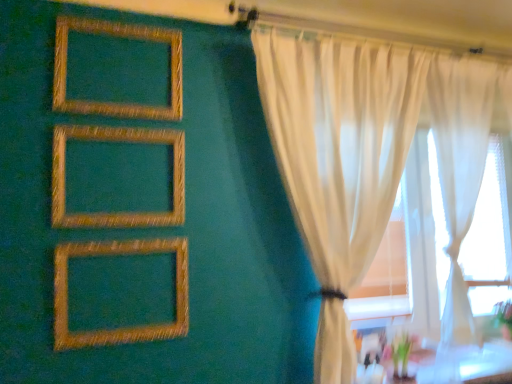
The image size is (512, 384). Describe the element at coordinates (120, 37) in the screenshot. I see `gold textured frame at upper left, acting as the 3th picture frame starting from the bottom` at that location.

Identify the location of gold textured picture frame at lower left, which is counted as the third picture frame, starting from the top. (119, 328).

Find the location of a particular element. gold textured frame at upper left, acting as the 3th picture frame starting from the bottom is located at coordinates (120, 37).

Which point is more forward, (104,103) or (63,253)?

The point (63,253) is closer to the camera.

Considering the relative sizes of gold textured frame at upper left, the 1th picture frame viewed from the top, and gold textured picture frame at lower left, placed as the first picture frame when sorted from bottom to top, in the image provided, is gold textured frame at upper left, the 1th picture frame viewed from the top, taller than gold textured picture frame at lower left, placed as the first picture frame when sorted from bottom to top,?

Indeed, gold textured frame at upper left, the 1th picture frame viewed from the top, has a greater height compared to gold textured picture frame at lower left, placed as the first picture frame when sorted from bottom to top.

From the image's perspective, relative to gold textured picture frame at lower left, which is counted as the third picture frame, starting from the top, is gold textured frame at upper left, the 1th picture frame viewed from the top, above or below?

From the image's perspective, gold textured frame at upper left, the 1th picture frame viewed from the top, appears above gold textured picture frame at lower left, which is counted as the third picture frame, starting from the top.

Is gold textured frame at upper left, the 1th picture frame viewed from the top, oriented towards gold textured picture frame at lower left, which is counted as the third picture frame, starting from the top?

No, gold textured frame at upper left, the 1th picture frame viewed from the top, is not turned towards gold textured picture frame at lower left, which is counted as the third picture frame, starting from the top.

Locate an element on the screen. This screenshot has height=384, width=512. the 1st picture frame above when counting from the sheer white curtains at right (from the image's perspective) is located at coordinates (116, 141).

Can you see sheer white curtains at right touching gold textured frame at center, placed as the second picture frame when sorted from top to bottom?

→ No, sheer white curtains at right is not with gold textured frame at center, placed as the second picture frame when sorted from top to bottom.

Considering the positions of objects sheer white curtains at right and gold textured frame at center, placed as the second picture frame when sorted from top to bottom, in the image provided, who is more to the right, sheer white curtains at right or gold textured frame at center, placed as the second picture frame when sorted from top to bottom,?

sheer white curtains at right.

Is sheer white curtains at right behind gold textured frame at upper left, the 1th picture frame viewed from the top?

Yes, sheer white curtains at right is behind gold textured frame at upper left, the 1th picture frame viewed from the top.

From the image's perspective, is sheer white curtains at right located above or below gold textured frame at upper left, the 1th picture frame viewed from the top?

From the image's perspective, sheer white curtains at right appears below gold textured frame at upper left, the 1th picture frame viewed from the top.

Is sheer white curtains at right bigger than gold textured frame at upper left, acting as the 3th picture frame starting from the bottom?

Correct, sheer white curtains at right is larger in size than gold textured frame at upper left, acting as the 3th picture frame starting from the bottom.

Is point (109, 28) closer or farther from the camera than point (469, 249)?

Point (109, 28) is closer to the camera than point (469, 249).

Considering the positions of objects gold textured frame at upper left, the 1th picture frame viewed from the top, and sheer white curtains at right in the image provided, who is in front, gold textured frame at upper left, the 1th picture frame viewed from the top, or sheer white curtains at right?

gold textured frame at upper left, the 1th picture frame viewed from the top.

From the picture: Based on their positions, is gold textured frame at upper left, the 1th picture frame viewed from the top, located to the left or right of sheer white curtains at right?

From the image, it's evident that gold textured frame at upper left, the 1th picture frame viewed from the top, is to the left of sheer white curtains at right.

Is gold textured frame at upper left, acting as the 3th picture frame starting from the bottom, wider or thinner than sheer white curtains at right?

gold textured frame at upper left, acting as the 3th picture frame starting from the bottom, is thinner than sheer white curtains at right.

Would you say white sheer curtain at right is outside gold textured picture frame at lower left, placed as the first picture frame when sorted from bottom to top?

Yes.

Visually, is white sheer curtain at right positioned to the left or to the right of gold textured picture frame at lower left, placed as the first picture frame when sorted from bottom to top?

In the image, white sheer curtain at right appears on the right side of gold textured picture frame at lower left, placed as the first picture frame when sorted from bottom to top.

You are a GUI agent. You are given a task and a screenshot of the screen. Output one action in this format:
    pyautogui.click(x=<x>, y=<y>)
    Task: Click on the picture frame that is below the white sheer curtain at right (from the image's perspective)
    This screenshot has width=512, height=384.
    Given the screenshot: What is the action you would take?
    pyautogui.click(x=119, y=328)

Measure the distance from gold textured frame at center, which ranks as the second picture frame in bottom-to-top order, to gold textured picture frame at lower left, placed as the first picture frame when sorted from bottom to top.

A distance of 9.43 inches exists between gold textured frame at center, which ranks as the second picture frame in bottom-to-top order, and gold textured picture frame at lower left, placed as the first picture frame when sorted from bottom to top.

The width and height of the screenshot is (512, 384). I want to click on picture frame on the right of gold textured frame at center, placed as the second picture frame when sorted from top to bottom, so click(119, 328).

Considering the relative positions of gold textured frame at center, which ranks as the second picture frame in bottom-to-top order, and gold textured picture frame at lower left, which is counted as the third picture frame, starting from the top, in the image provided, is gold textured frame at center, which ranks as the second picture frame in bottom-to-top order, in front of gold textured picture frame at lower left, which is counted as the third picture frame, starting from the top,?

No, gold textured frame at center, which ranks as the second picture frame in bottom-to-top order, is further to the viewer.

From a real-world perspective, relative to gold textured picture frame at lower left, placed as the first picture frame when sorted from bottom to top, is gold textured frame at center, placed as the second picture frame when sorted from top to bottom, vertically above or below?

In terms of real-world spatial position, gold textured frame at center, placed as the second picture frame when sorted from top to bottom, is above gold textured picture frame at lower left, placed as the first picture frame when sorted from bottom to top.

The image size is (512, 384). I want to click on bay window behind the gold textured picture frame at lower left, which is counted as the third picture frame, starting from the top, so click(x=489, y=226).

Is gold textured picture frame at lower left, which is counted as the third picture frame, starting from the top, to the left or to the right of sheer white curtains at right in the image?

In the image, gold textured picture frame at lower left, which is counted as the third picture frame, starting from the top, appears on the left side of sheer white curtains at right.

Considering the relative positions of gold textured picture frame at lower left, placed as the first picture frame when sorted from bottom to top, and sheer white curtains at right in the image provided, is gold textured picture frame at lower left, placed as the first picture frame when sorted from bottom to top, behind sheer white curtains at right?

No, gold textured picture frame at lower left, placed as the first picture frame when sorted from bottom to top, is in front of sheer white curtains at right.

You are a GUI agent. You are given a task and a screenshot of the screen. Output one action in this format:
    pyautogui.click(x=<x>, y=<y>)
    Task: Click on the 2nd picture frame behind the gold textured picture frame at lower left, which is counted as the third picture frame, starting from the top
    
    Given the screenshot: What is the action you would take?
    pyautogui.click(x=120, y=37)

From the sheer white curtains at right, count the 2nd picture frame to the left and point to it. Please provide its 2D coordinates.

[(116, 141)]

Looking at the image, which one is located further to gold textured picture frame at lower left, which is counted as the third picture frame, starting from the top, white sheer curtain at right or sheer white curtains at right?

sheer white curtains at right.

When comparing their distances from gold textured frame at upper left, acting as the 3th picture frame starting from the bottom, does gold textured picture frame at lower left, placed as the first picture frame when sorted from bottom to top, or gold textured frame at center, placed as the second picture frame when sorted from top to bottom, seem closer?

gold textured frame at center, placed as the second picture frame when sorted from top to bottom, is closer to gold textured frame at upper left, acting as the 3th picture frame starting from the bottom.

Based on the photo, which object lies further to the anchor point white sheer curtain at right, gold textured frame at upper left, acting as the 3th picture frame starting from the bottom, or gold textured picture frame at lower left, which is counted as the third picture frame, starting from the top?

gold textured picture frame at lower left, which is counted as the third picture frame, starting from the top, is further to white sheer curtain at right.

From the image, which object appears to be nearer to gold textured picture frame at lower left, which is counted as the third picture frame, starting from the top, sheer white curtains at right or gold textured frame at center, placed as the second picture frame when sorted from top to bottom?

gold textured frame at center, placed as the second picture frame when sorted from top to bottom, is closer to gold textured picture frame at lower left, which is counted as the third picture frame, starting from the top.

Based on their spatial positions, is gold textured picture frame at lower left, placed as the first picture frame when sorted from bottom to top, or gold textured frame at center, which ranks as the second picture frame in bottom-to-top order, closer to white sheer curtain at right?

gold textured frame at center, which ranks as the second picture frame in bottom-to-top order.

Considering their positions, is gold textured frame at upper left, the 1th picture frame viewed from the top, positioned closer to gold textured frame at center, which ranks as the second picture frame in bottom-to-top order, than white sheer curtain at right?

gold textured frame at upper left, the 1th picture frame viewed from the top, is positioned closer to the anchor gold textured frame at center, which ranks as the second picture frame in bottom-to-top order.

Which object lies nearer to the anchor point gold textured frame at upper left, acting as the 3th picture frame starting from the bottom, white sheer curtain at right or gold textured picture frame at lower left, placed as the first picture frame when sorted from bottom to top?

The object closer to gold textured frame at upper left, acting as the 3th picture frame starting from the bottom, is gold textured picture frame at lower left, placed as the first picture frame when sorted from bottom to top.

Estimate the real-world distances between objects in this image. Which object is further from sheer white curtains at right, gold textured frame at center, placed as the second picture frame when sorted from top to bottom, or gold textured picture frame at lower left, placed as the first picture frame when sorted from bottom to top?

gold textured picture frame at lower left, placed as the first picture frame when sorted from bottom to top, is further to sheer white curtains at right.

Find the location of a particular element. Image resolution: width=512 pixels, height=384 pixels. picture frame between gold textured frame at upper left, acting as the 3th picture frame starting from the bottom, and gold textured picture frame at lower left, placed as the first picture frame when sorted from bottom to top, in the up-down direction is located at coordinates (116, 141).

You are a GUI agent. You are given a task and a screenshot of the screen. Output one action in this format:
    pyautogui.click(x=<x>, y=<y>)
    Task: Click on the picture frame between gold textured frame at center, which ranks as the second picture frame in bottom-to-top order, and white sheer curtain at right from left to right
    This screenshot has height=384, width=512.
    Given the screenshot: What is the action you would take?
    pyautogui.click(x=119, y=328)

Locate an element on the screen. The width and height of the screenshot is (512, 384). curtain between gold textured picture frame at lower left, which is counted as the third picture frame, starting from the top, and sheer white curtains at right, in the horizontal direction is located at coordinates (353, 135).

This screenshot has width=512, height=384. Find the location of `curtain situated between gold textured frame at upper left, acting as the 3th picture frame starting from the bottom, and sheer white curtains at right from left to right`. curtain situated between gold textured frame at upper left, acting as the 3th picture frame starting from the bottom, and sheer white curtains at right from left to right is located at coordinates (353, 135).